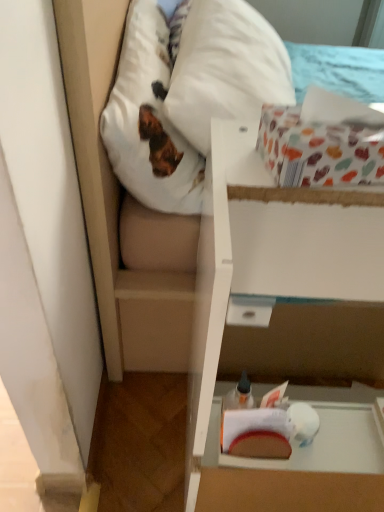
The height and width of the screenshot is (512, 384). I want to click on white fabric mattress at upper center, so click(x=186, y=93).

The image size is (384, 512). I want to click on the 2nd cardboard box below the white soft pillow at upper left (from the image's perspective), so click(x=272, y=273).

Which point is more distant from viewer, (158, 29) or (234, 331)?

Point (234, 331)

From a real-world perspective, relative to white cardboard box at center, which is the second cardboard box in top-to-bottom order, is white soft pillow at upper left vertically above or below?

From a real-world perspective, white soft pillow at upper left is physically above white cardboard box at center, which is the second cardboard box in top-to-bottom order.

Looking at this image, can you tell me how much white soft pillow at upper left and white cardboard box at center, which is the second cardboard box in top-to-bottom order, differ in facing direction?

The facing directions of white soft pillow at upper left and white cardboard box at center, which is the second cardboard box in top-to-bottom order, are 85 degrees apart.

Is white soft pillow at upper left inside the boundaries of patterned paper box at upper right, marked as the 1th cardboard box in a top-to-bottom arrangement, or outside?

white soft pillow at upper left lies outside patterned paper box at upper right, marked as the 1th cardboard box in a top-to-bottom arrangement.

From the image's perspective, which object appears higher, white soft pillow at upper left or patterned paper box at upper right, the second cardboard box from the bottom?

white soft pillow at upper left appears higher in the image.

Does white soft pillow at upper left have a greater height compared to patterned paper box at upper right, the second cardboard box from the bottom?

Yes.

Can you tell me how much white soft pillow at upper left and white fabric mattress at upper center differ in facing direction?

white soft pillow at upper left and white fabric mattress at upper center are facing 4.96 degrees away from each other.

Is white fabric mattress at upper center at the back of white soft pillow at upper left?

Absolutely, white soft pillow at upper left is directed away from white fabric mattress at upper center.

Locate an element on the screen. The width and height of the screenshot is (384, 512). pillow on the left of white fabric mattress at upper center is located at coordinates (149, 119).

From a real-world perspective, is white fabric mattress at upper center positioned over white soft pillow at upper left based on gravity?

No, from a real-world perspective, white fabric mattress at upper center is not above white soft pillow at upper left.

Is point (148, 96) behind point (178, 167)?

No, (148, 96) is closer to viewer.

How different are the orientations of white fabric mattress at upper center and white soft pillow at upper left in degrees?

The facing directions of white fabric mattress at upper center and white soft pillow at upper left are 4.96 degrees apart.

Considering the sizes of objects white fabric mattress at upper center and white soft pillow at upper left in the image provided, who is bigger, white fabric mattress at upper center or white soft pillow at upper left?

white fabric mattress at upper center.

Which object is closer to the camera, patterned paper box at upper right, marked as the 1th cardboard box in a top-to-bottom arrangement, or white cardboard box at center, which ranks as the 1th cardboard box in bottom-to-top order?

white cardboard box at center, which ranks as the 1th cardboard box in bottom-to-top order, is closer to the camera.

Which is correct: patterned paper box at upper right, marked as the 1th cardboard box in a top-to-bottom arrangement, is inside white cardboard box at center, which ranks as the 1th cardboard box in bottom-to-top order, or outside of it?

patterned paper box at upper right, marked as the 1th cardboard box in a top-to-bottom arrangement, lies outside white cardboard box at center, which ranks as the 1th cardboard box in bottom-to-top order.

From a real-world perspective, which object rests below the other?

In real-world perspective, white cardboard box at center, which is the second cardboard box in top-to-bottom order, is lower.

Considering the sizes of patterned paper box at upper right, the second cardboard box from the bottom, and white cardboard box at center, which ranks as the 1th cardboard box in bottom-to-top order, in the image, is patterned paper box at upper right, the second cardboard box from the bottom, taller or shorter than white cardboard box at center, which ranks as the 1th cardboard box in bottom-to-top order,?

patterned paper box at upper right, the second cardboard box from the bottom, is shorter than white cardboard box at center, which ranks as the 1th cardboard box in bottom-to-top order.

Is white cardboard box at center, which is the second cardboard box in top-to-bottom order, inside white fabric mattress at upper center?

No, white cardboard box at center, which is the second cardboard box in top-to-bottom order, is not a part of white fabric mattress at upper center.

Between white fabric mattress at upper center and white cardboard box at center, which ranks as the 1th cardboard box in bottom-to-top order, which one appears on the left side from the viewer's perspective?

white fabric mattress at upper center is more to the left.

Which is in front, white fabric mattress at upper center or white cardboard box at center, which is the second cardboard box in top-to-bottom order?

white cardboard box at center, which is the second cardboard box in top-to-bottom order, is more forward.

Based on the photo, which of these two, white fabric mattress at upper center or white cardboard box at center, which ranks as the 1th cardboard box in bottom-to-top order, stands taller?

Standing taller between the two is white cardboard box at center, which ranks as the 1th cardboard box in bottom-to-top order.

From a real-world perspective, relative to white soft pillow at upper left, is white cardboard box at center, which ranks as the 1th cardboard box in bottom-to-top order, vertically above or below?

Clearly, from a real-world perspective, white cardboard box at center, which ranks as the 1th cardboard box in bottom-to-top order, is below white soft pillow at upper left.

Does white cardboard box at center, which ranks as the 1th cardboard box in bottom-to-top order, come behind white soft pillow at upper left?

No, it is in front of white soft pillow at upper left.

Considering the positions of point (301, 258) and point (149, 125), is point (301, 258) closer or farther from the camera than point (149, 125)?

Point (301, 258) is positioned closer to the camera compared to point (149, 125).

Locate an element on the screen. The height and width of the screenshot is (512, 384). pillow above the white cardboard box at center, which is the second cardboard box in top-to-bottom order (from the image's perspective) is located at coordinates (149, 119).

In order to click on the 1st cardboard box to the right when counting from the white soft pillow at upper left in this screenshot , I will do `click(324, 140)`.

Looking at the image, which one is located closer to white soft pillow at upper left, white cardboard box at center, which ranks as the 1th cardboard box in bottom-to-top order, or white fabric mattress at upper center?

white fabric mattress at upper center is closer to white soft pillow at upper left.

Estimate the real-world distances between objects in this image. Which object is further from white soft pillow at upper left, patterned paper box at upper right, marked as the 1th cardboard box in a top-to-bottom arrangement, or white fabric mattress at upper center?

patterned paper box at upper right, marked as the 1th cardboard box in a top-to-bottom arrangement.

Estimate the real-world distances between objects in this image. Which object is further from patterned paper box at upper right, the second cardboard box from the bottom, white fabric mattress at upper center or white cardboard box at center, which is the second cardboard box in top-to-bottom order?

white fabric mattress at upper center is positioned further to the anchor patterned paper box at upper right, the second cardboard box from the bottom.

Looking at the image, which one is located further to patterned paper box at upper right, the second cardboard box from the bottom, white soft pillow at upper left or white cardboard box at center, which is the second cardboard box in top-to-bottom order?

white soft pillow at upper left lies further to patterned paper box at upper right, the second cardboard box from the bottom, than the other object.

Which object lies nearer to the anchor point patterned paper box at upper right, the second cardboard box from the bottom, white cardboard box at center, which ranks as the 1th cardboard box in bottom-to-top order, or white fabric mattress at upper center?

white cardboard box at center, which ranks as the 1th cardboard box in bottom-to-top order, is closer to patterned paper box at upper right, the second cardboard box from the bottom.

Looking at the image, which one is located further to white soft pillow at upper left, white fabric mattress at upper center or white cardboard box at center, which ranks as the 1th cardboard box in bottom-to-top order?

Based on the image, white cardboard box at center, which ranks as the 1th cardboard box in bottom-to-top order, appears to be further to white soft pillow at upper left.

Estimate the real-world distances between objects in this image. Which object is closer to white soft pillow at upper left, white cardboard box at center, which is the second cardboard box in top-to-bottom order, or patterned paper box at upper right, marked as the 1th cardboard box in a top-to-bottom arrangement?

Among the two, white cardboard box at center, which is the second cardboard box in top-to-bottom order, is located nearer to white soft pillow at upper left.

Estimate the real-world distances between objects in this image. Which object is closer to white fabric mattress at upper center, white cardboard box at center, which ranks as the 1th cardboard box in bottom-to-top order, or white soft pillow at upper left?

white soft pillow at upper left is positioned closer to the anchor white fabric mattress at upper center.

The image size is (384, 512). Identify the location of cardboard box between white fabric mattress at upper center and white cardboard box at center, which ranks as the 1th cardboard box in bottom-to-top order, in the up-down direction. [324, 140].

You are a GUI agent. You are given a task and a screenshot of the screen. Output one action in this format:
    pyautogui.click(x=<x>, y=<y>)
    Task: Click on the mattress between white soft pillow at upper left and patterned paper box at upper right, marked as the 1th cardboard box in a top-to-bottom arrangement, from left to right
    The height and width of the screenshot is (512, 384).
    Given the screenshot: What is the action you would take?
    pyautogui.click(x=186, y=93)

Where is `cardboard box between white soft pillow at upper left and white cardboard box at center, which ranks as the 1th cardboard box in bottom-to-top order, in the vertical direction`? This screenshot has height=512, width=384. cardboard box between white soft pillow at upper left and white cardboard box at center, which ranks as the 1th cardboard box in bottom-to-top order, in the vertical direction is located at coordinates (324, 140).

Locate an element on the screen. Image resolution: width=384 pixels, height=512 pixels. mattress between white soft pillow at upper left and white cardboard box at center, which ranks as the 1th cardboard box in bottom-to-top order, from top to bottom is located at coordinates (186, 93).